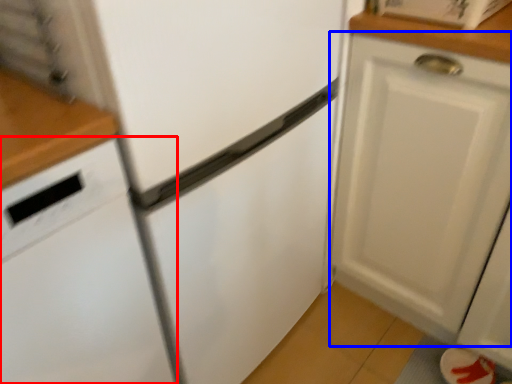
Question: Which object is closer to the camera taking this photo, dish washer (highlighted by a red box) or cabinetry (highlighted by a blue box)?

Choices:
 (A) dish washer
 (B) cabinetry

Answer: (A)